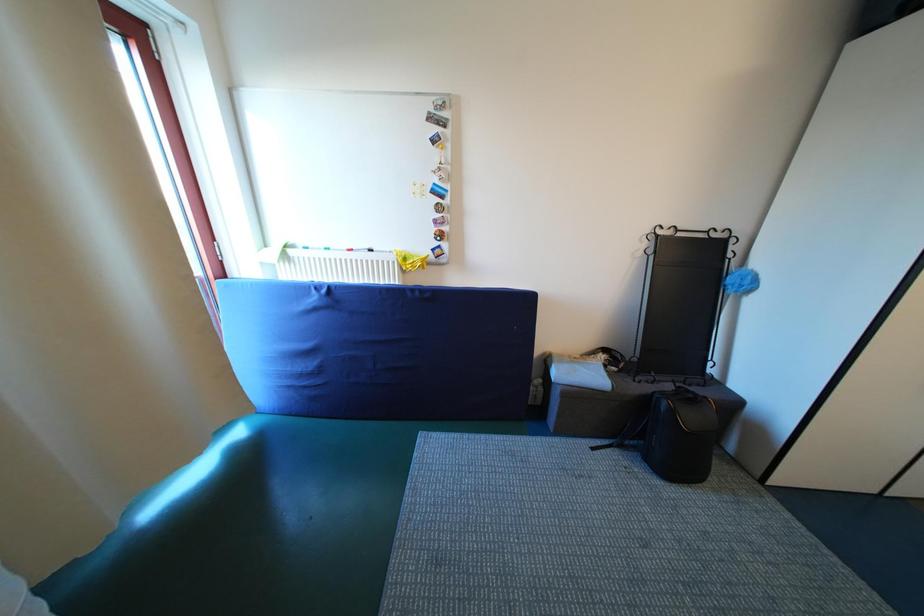
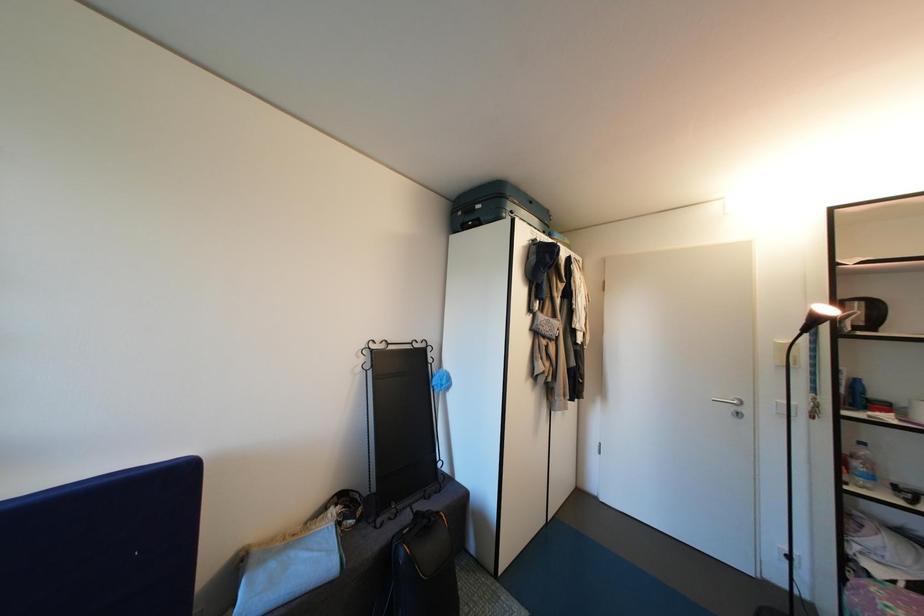
The images are taken continuously from a first-person perspective. In which direction is your viewpoint rotating?

The rotation direction of the camera is right-up.